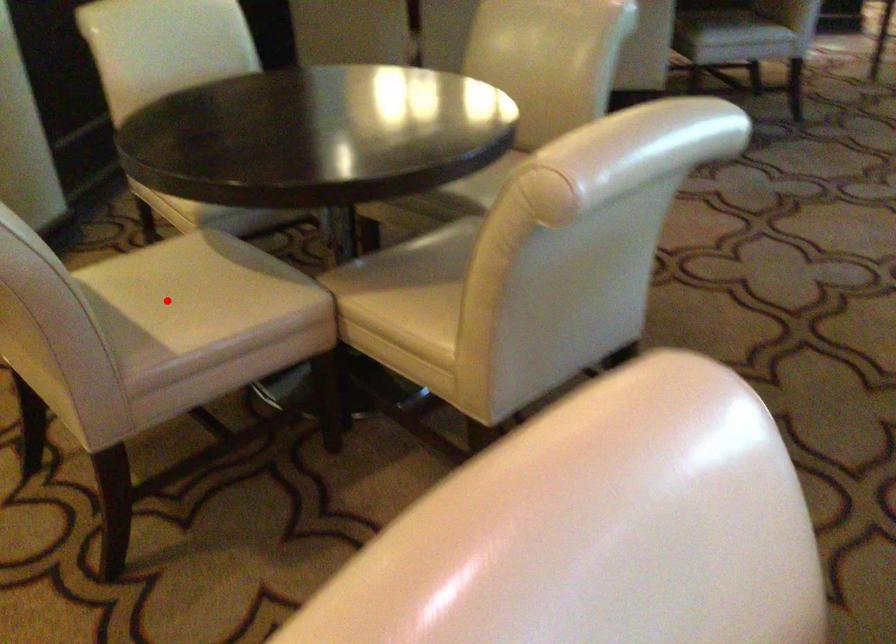
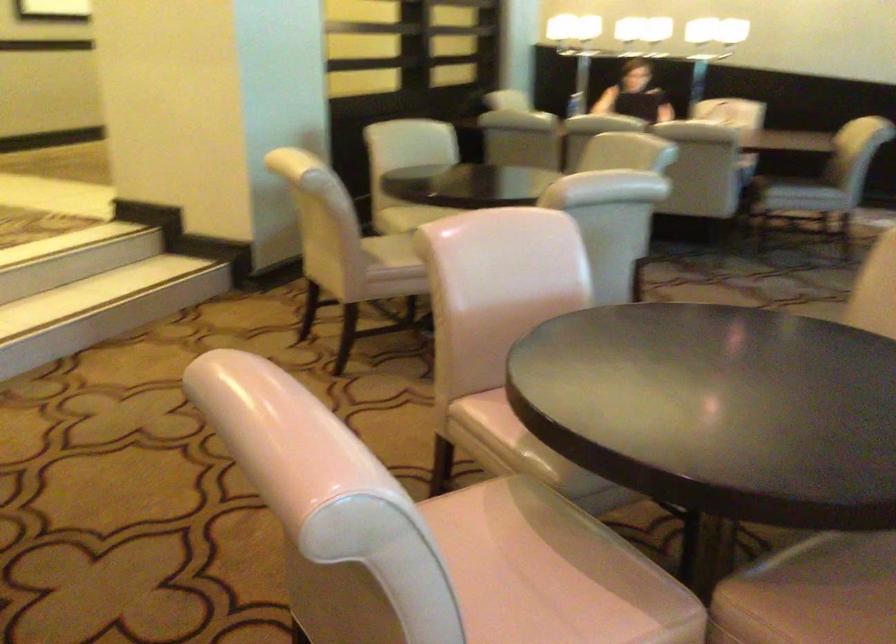
Where in the second image is the point corresponding to the highlighted location from the first image?

(391, 252)